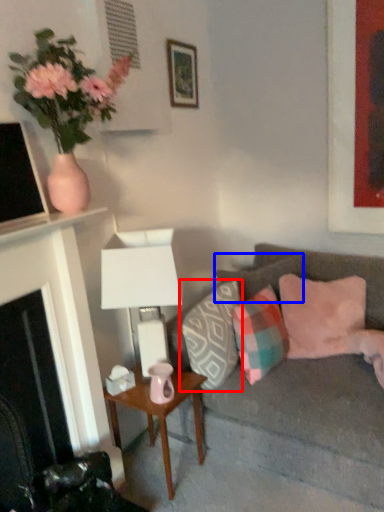
Question: Which object is further to the camera taking this photo, pillow (highlighted by a red box) or pillow (highlighted by a blue box)?

Choices:
 (A) pillow
 (B) pillow

Answer: (B)